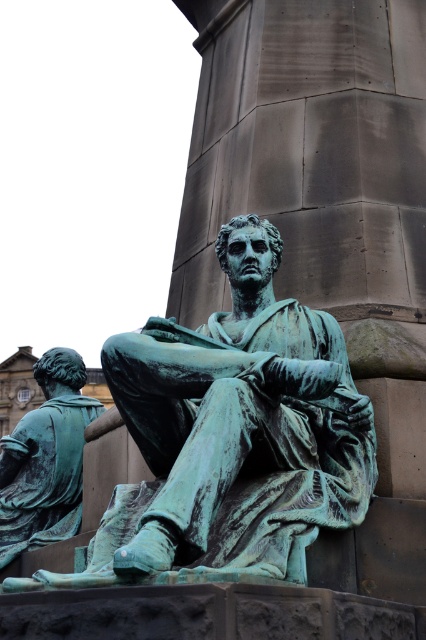
Question: Is green patina statue at center smaller than green patina statue at lower left?

Choices:
 (A) yes
 (B) no

Answer: (B)

Question: Does green patina statue at center appear over green patina statue at lower left?

Choices:
 (A) no
 (B) yes

Answer: (B)

Question: Is green patina statue at center further to camera compared to green patina statue at lower left?

Choices:
 (A) yes
 (B) no

Answer: (B)